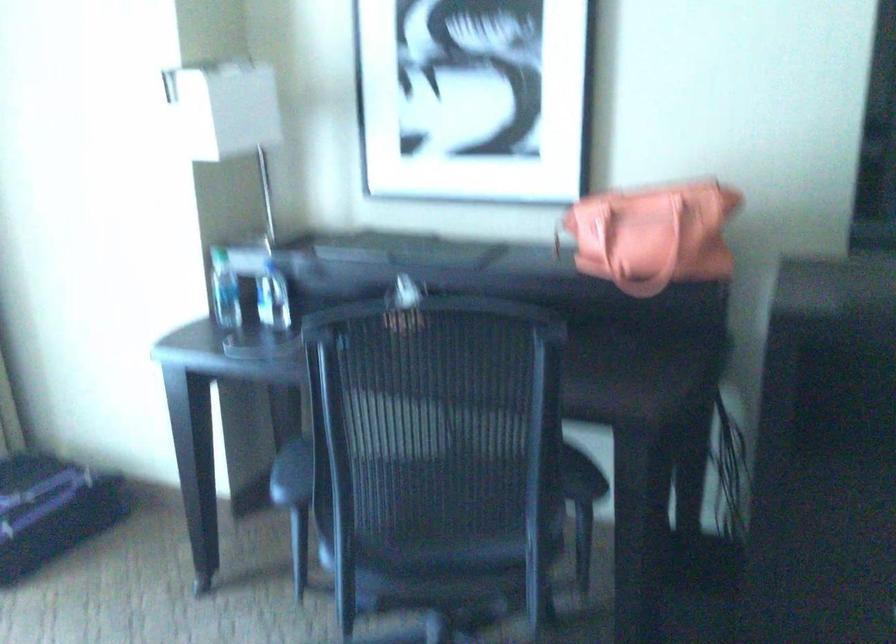
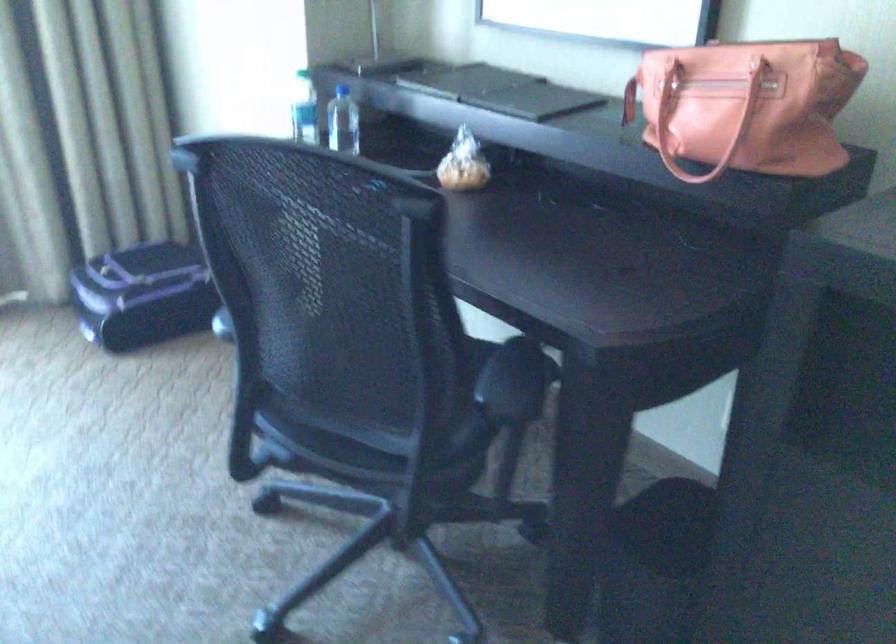
The point at (460, 562) is marked in the first image. Where is the corresponding point in the second image?

(364, 440)